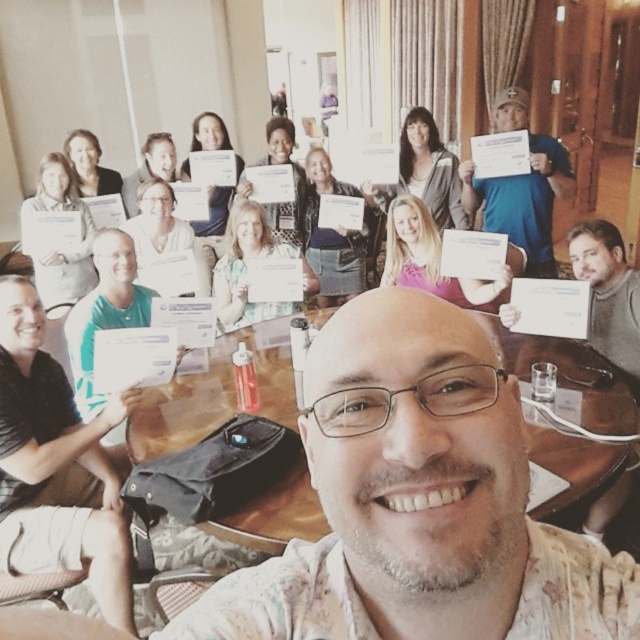
From the picture: Please look at the image and locate the point at coordinates (x=524, y=200). What object is located at that position?

The point at coordinates (x=524, y=200) indicates the blue fabric shirt at upper right.

In the scene shown: You are a photographer at the event and need to capture a photo that includes both the black shirt at lower left and the blue fabric shirt at upper right. Given that your camera has a maximum focus range of 2.5 meters, will you be able to include both in the same frame without moving the camera?

The black shirt at lower left and blue fabric shirt at upper right are 2.73 meters apart from each other, which exceeds the camera maximum focus range of 2.5 meters. Therefore, you cannot include both in the same frame without moving the camera.